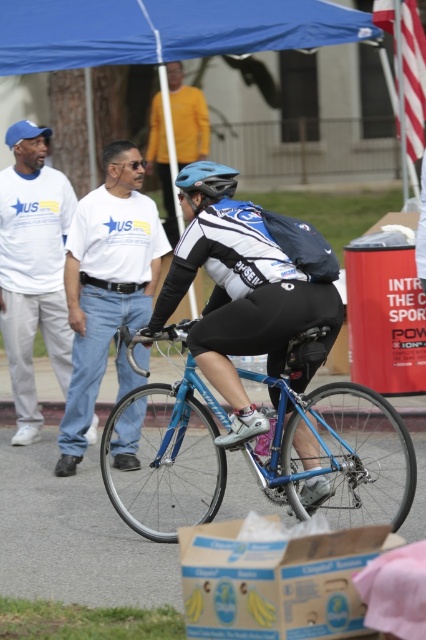
Question: Which point is farther to the camera?

Choices:
 (A) (345, 614)
 (B) (106, 276)
 (C) (8, 170)
 (D) (68, 49)

Answer: (D)

Question: Estimate the real-world distances between objects in this image. Which object is farther from the matte yellow shirt at upper center?

Choices:
 (A) blue matte helmet at center
 (B) cardboard box with bananas at lower center
 (C) white t-shirt at center
 (D) blue fabric canopy at upper center

Answer: (B)

Question: Considering the real-world distances, which object is farthest from the blue fabric canopy at upper center?

Choices:
 (A) cardboard box with bananas at lower center
 (B) blue metallic bicycle at center
 (C) white t-shirt at center
 (D) shiny blue bicycle at center

Answer: (A)

Question: Does white cotton shirt at left have a smaller size compared to matte yellow shirt at upper center?

Choices:
 (A) yes
 (B) no

Answer: (A)

Question: Can you confirm if blue metallic bicycle at center is positioned to the left of white cotton shirt at left?

Choices:
 (A) yes
 (B) no

Answer: (B)

Question: Is shiny blue bicycle at center to the left of white cotton shirt at left from the viewer's perspective?

Choices:
 (A) yes
 (B) no

Answer: (B)